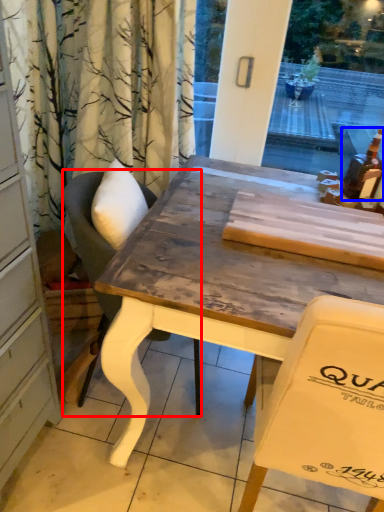
Question: Which point is closer to the camera, chair (highlighted by a red box) or alcohol (highlighted by a blue box)?

Choices:
 (A) chair
 (B) alcohol

Answer: (A)